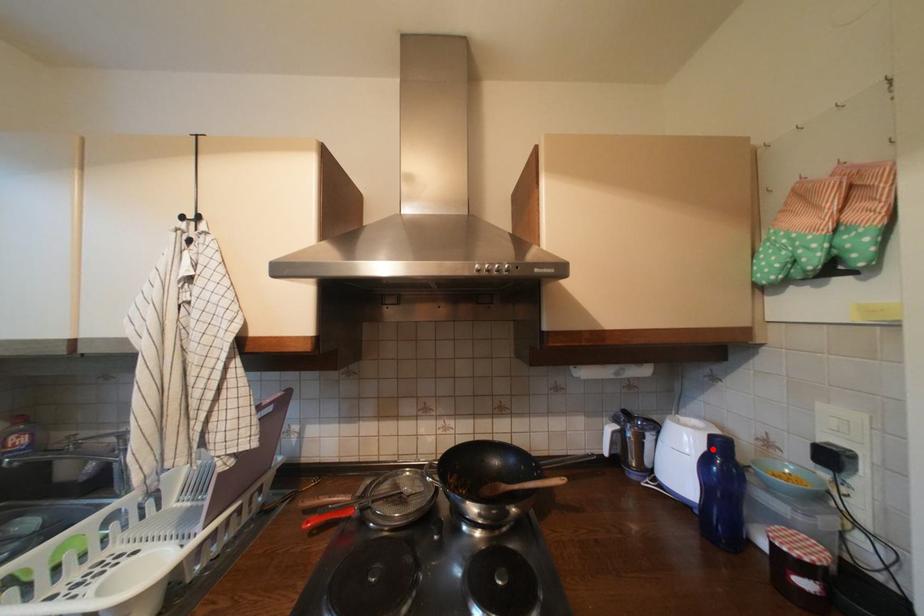
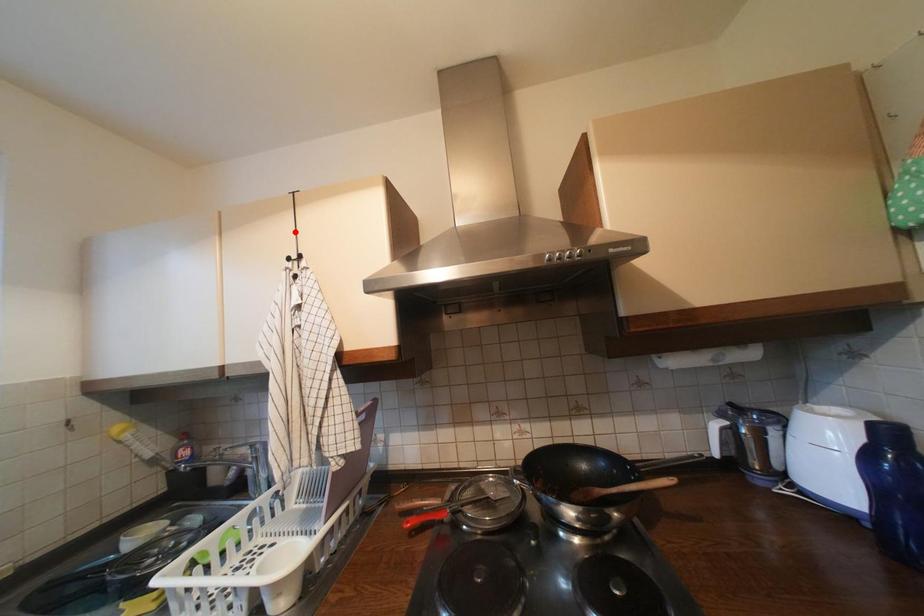
I am providing you with two images of the same scene from different viewpoints. A red point is marked on the first image and another point is marked on the second image. Is the marked point in image1 the same physical position as the marked point in image2?

No